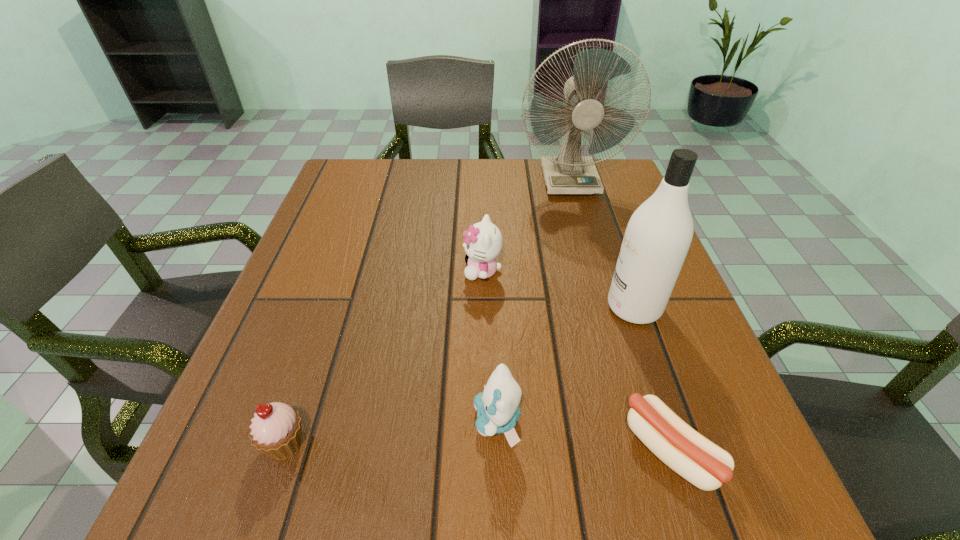
Where is `vacant space at the left edge of the desktop`? Image resolution: width=960 pixels, height=540 pixels. vacant space at the left edge of the desktop is located at coordinates (306, 337).

Where is `vacant area at the right edge of the desktop`? The image size is (960, 540). vacant area at the right edge of the desktop is located at coordinates (598, 218).

At what (x,y) coordinates should I click in order to perform the action: click on free region at the far left corner of the desktop. Please return your answer as a coordinate pair (x, y). Image resolution: width=960 pixels, height=540 pixels. Looking at the image, I should click on (350, 170).

Find the location of a particular element. vacant space at the near left corner of the desktop is located at coordinates (252, 461).

This screenshot has height=540, width=960. Find the location of `free location at the far right corner`. free location at the far right corner is located at coordinates (610, 166).

At what (x,y) coordinates should I click in order to perform the action: click on unoccupied area between the fifth nearest object and the shortest object. Please return your answer as a coordinate pair (x, y). The image size is (960, 540). Looking at the image, I should click on (577, 361).

Locate an element on the screen. The width and height of the screenshot is (960, 540). empty space between the fifth nearest object and the fan is located at coordinates (526, 226).

At what (x,y) coordinates should I click in order to perform the action: click on vacant space that's between the leftmost object and the shortest object. Please return your answer as a coordinate pair (x, y). The width and height of the screenshot is (960, 540). Looking at the image, I should click on (478, 448).

The width and height of the screenshot is (960, 540). In order to click on empty location between the fourth nearest object and the nearer kitten in this screenshot , I will do `click(565, 364)`.

Find the location of a particular element. The height and width of the screenshot is (540, 960). vacant area between the farther kitten and the third farthest object is located at coordinates (558, 289).